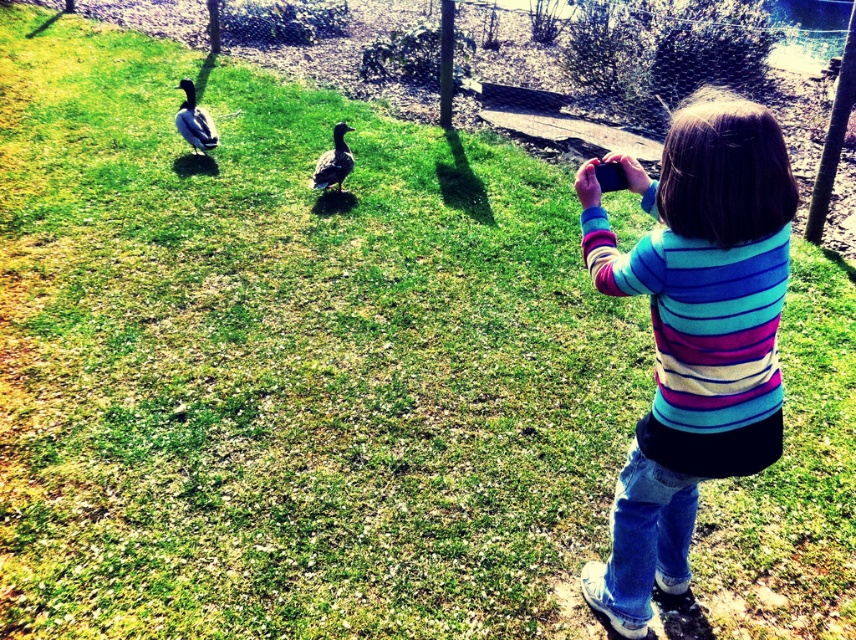
Is point (477, 51) behind point (192, 92)?

Yes, it is behind point (192, 92).

Is metallic wire mesh at upper center positioned before brown feathered duck at left?

Yes.

Does point (373, 19) come in front of point (201, 138)?

That is False.

This screenshot has width=856, height=640. What are the coordinates of `metallic wire mesh at upper center` in the screenshot? It's located at (349, 58).

Does brown feathered duck at left lie in front of brown matte duck at center?

No, it is not.

The image size is (856, 640). Describe the element at coordinates (194, 122) in the screenshot. I see `brown feathered duck at left` at that location.

The height and width of the screenshot is (640, 856). I want to click on brown feathered duck at left, so click(194, 122).

Between metallic wire mesh at upper center and brown matte duck at center, which one appears on the left side from the viewer's perspective?

brown matte duck at center

Is point (553, 120) closer to camera compared to point (342, 147)?

No, (553, 120) is further to viewer.

Locate an element on the screen. The width and height of the screenshot is (856, 640). metallic wire mesh at upper center is located at coordinates (349, 58).